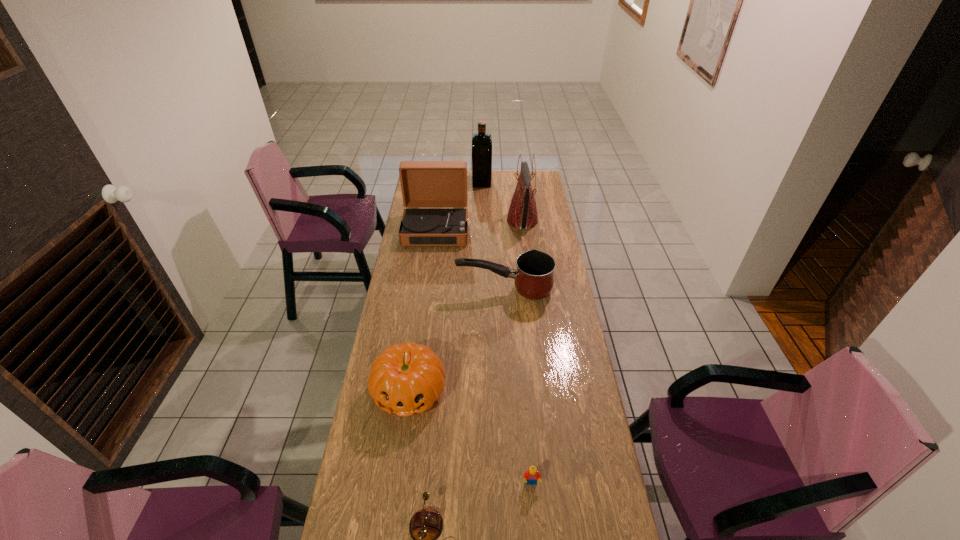
Find the location of `handbag`. handbag is located at coordinates (522, 213).

Where is `liquor`? liquor is located at coordinates (481, 142).

In order to click on phonograph record in this screenshot , I will do `click(434, 193)`.

Image resolution: width=960 pixels, height=540 pixels. In order to click on pumpkin in this screenshot , I will do 407,378.

Image resolution: width=960 pixels, height=540 pixels. I want to click on saucepan, so click(534, 278).

Locate an element on the screen. Lego is located at coordinates (531, 475).

Identify the location of vacant space situated 0.060m on the front of the handbag. This screenshot has width=960, height=540. (525, 242).

Where is `vacant space located 0.130m on the front label of the liquor`? The image size is (960, 540). vacant space located 0.130m on the front label of the liquor is located at coordinates (450, 181).

Locate an element on the screen. Image resolution: width=960 pixels, height=540 pixels. vacant region located on the front label of the liquor is located at coordinates (414, 181).

You are a GUI agent. You are given a task and a screenshot of the screen. Output one action in this format:
    pyautogui.click(x=<x>, y=<y>)
    Task: Click on the vacant space located on the front label of the liquor
    This screenshot has height=540, width=960.
    Given the screenshot: What is the action you would take?
    pyautogui.click(x=445, y=181)